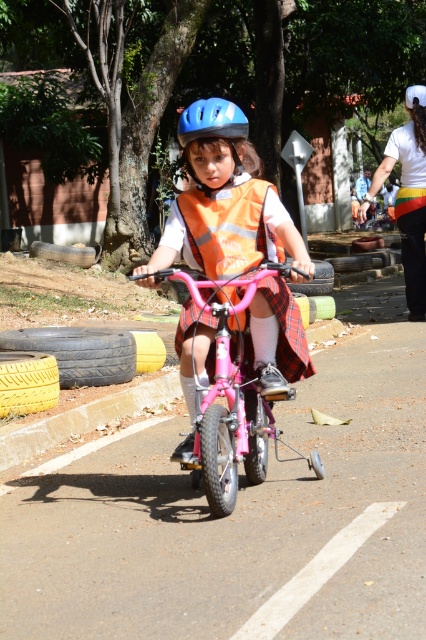
Question: From the image, what is the correct spatial relationship of pink matte bicycle at center in relation to orange reflective safety vest at center?

Choices:
 (A) above
 (B) below

Answer: (B)

Question: Can you confirm if pink matte bicycle at center is positioned to the left of blue matte helmet at upper center?

Choices:
 (A) no
 (B) yes

Answer: (A)

Question: Which point is closer to the camera?

Choices:
 (A) 250,456
 (B) 201,134

Answer: (B)

Question: Which point is farther from the camera taking this photo?

Choices:
 (A) (261, 429)
 (B) (195, 138)
 (C) (236, 138)
 (D) (226, 196)

Answer: (A)

Question: Does pink matte bicycle at center appear on the left side of blue matte helmet at upper center?

Choices:
 (A) yes
 (B) no

Answer: (B)

Question: Which point is closer to the camera taking this photo?

Choices:
 (A) (221, 124)
 (B) (221, 500)

Answer: (B)